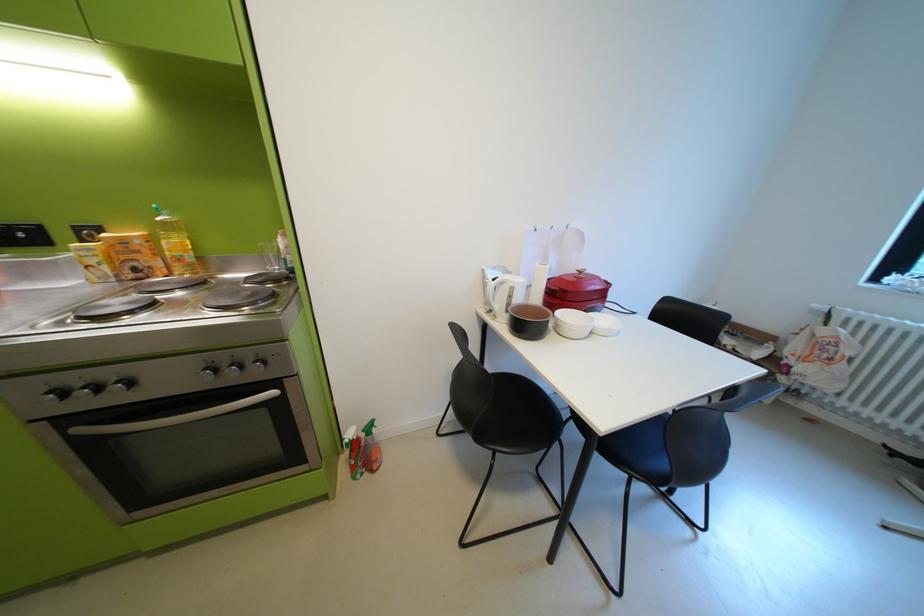
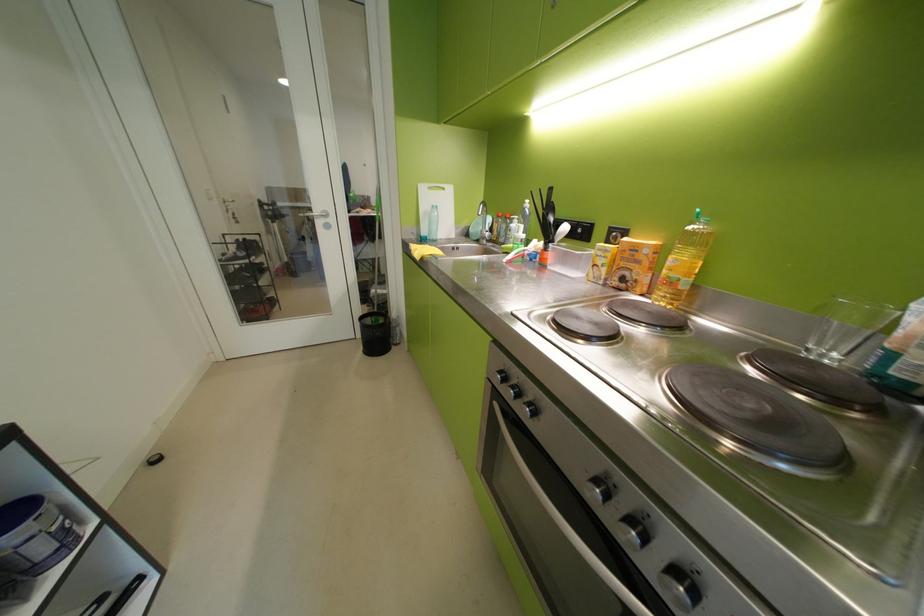
The first image is from the beginning of the video and the second image is from the end. How did the camera likely rotate when shooting the video?

The camera's rotation is toward left-down.